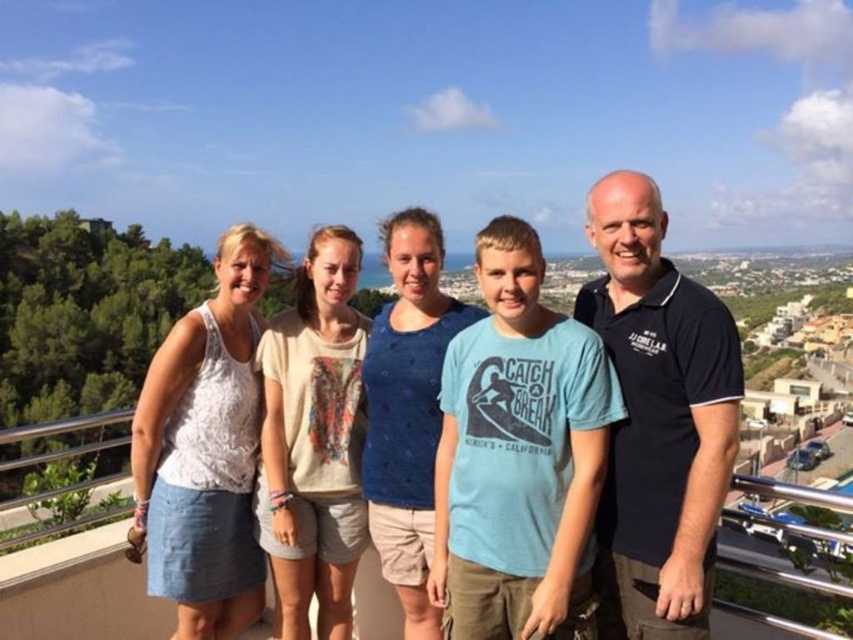
Does white cotton tank top at center appear on the left side of white lace tank top at upper left?

In fact, white cotton tank top at center is to the right of white lace tank top at upper left.

Which is more to the right, white cotton tank top at center or white lace tank top at upper left?

From the viewer's perspective, white cotton tank top at center appears more on the right side.

Does point (641, 193) come farther from viewer compared to point (175, 548)?

Yes.

Image resolution: width=853 pixels, height=640 pixels. What are the coordinates of `white cotton tank top at center` in the screenshot? It's located at (659, 419).